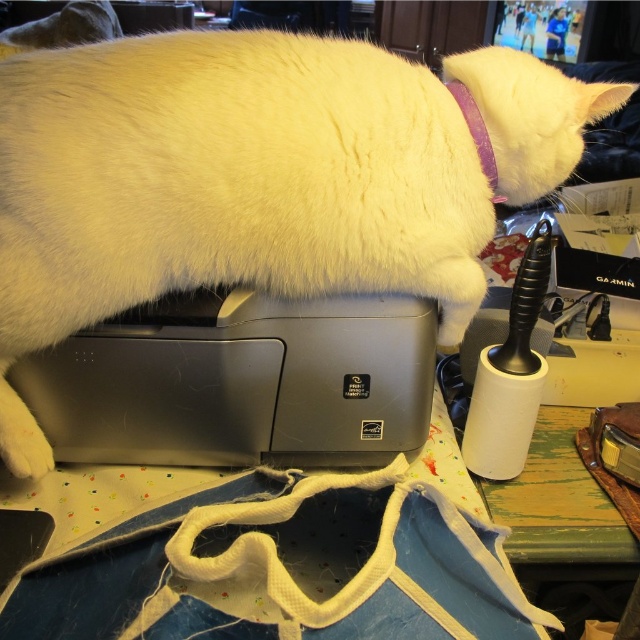
Looking at this image, you are a delivery person who just arrived at the office. You need to place a new purple fabric neckband at upper right on the desk behind the satin silver printer at center. Can you place it there without moving the printer?

The satin silver printer at center is in front of the purple fabric neckband at upper right, so the desk behind the printer is where the neckband is already located. Therefore, you don not need to move the printer to place it there.

You are organizing items in a room and see the white fluffy cat at upper center and the purple fabric neckband at upper right. Which object is positioned more to the left side of the scene?

The white fluffy cat at upper center is positioned more to the left side of the scene compared to the purple fabric neckband at upper right.

You are a delivery person who just arrived at the office and need to place a new Garmin box on the desk. You see the white fluffy cat at upper center and the satin silver printer at center. Which object should you avoid placing the box near to prevent disturbing the cat?

You should avoid placing the box near the white fluffy cat at upper center because it is in front of the satin silver printer at center and might be startled by the movement.